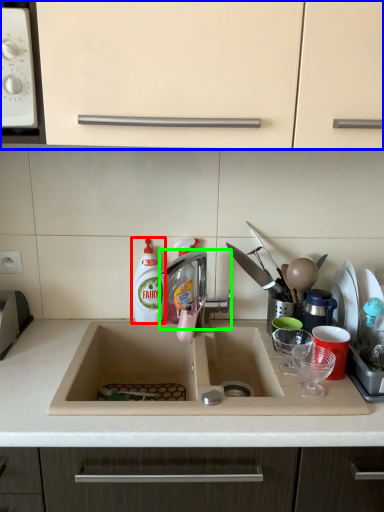
Question: Based on their relative distances, which object is farther from cleaning product (highlighted by a red box)? Choose from cabinetry (highlighted by a blue box) and tap (highlighted by a green box).

Choices:
 (A) cabinetry
 (B) tap

Answer: (A)